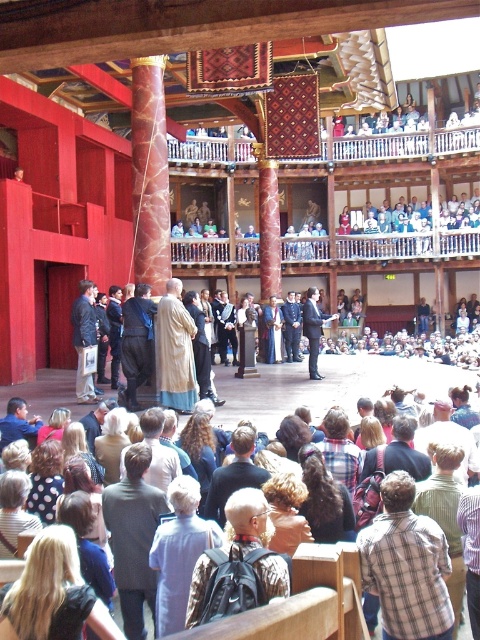
Question: Which object is closer to the camera taking this photo?

Choices:
 (A) dark brown leather jacket at center
 (B) camouflage backpack at lower center
 (C) dark suit at center
 (D) plaid shirt at center

Answer: (B)

Question: Considering the relative positions of plaid shirt at center and camouflage backpack at lower center in the image provided, where is plaid shirt at center located with respect to camouflage backpack at lower center?

Choices:
 (A) left
 (B) right

Answer: (B)

Question: Which point appears closest to the camera in this image?

Choices:
 (A) (312, 291)
 (B) (120, 636)

Answer: (B)

Question: Considering the relative positions of blonde hair at lower left and dark suit at center in the image provided, where is blonde hair at lower left located with respect to dark suit at center?

Choices:
 (A) left
 (B) right

Answer: (A)

Question: Where is striped shirt at lower right located in relation to dark suit at center in the image?

Choices:
 (A) left
 (B) right

Answer: (A)

Question: Which of these objects is positioned closest to the blonde hair at lower left?

Choices:
 (A) striped shirt at lower right
 (B) dark gray suit at center

Answer: (B)